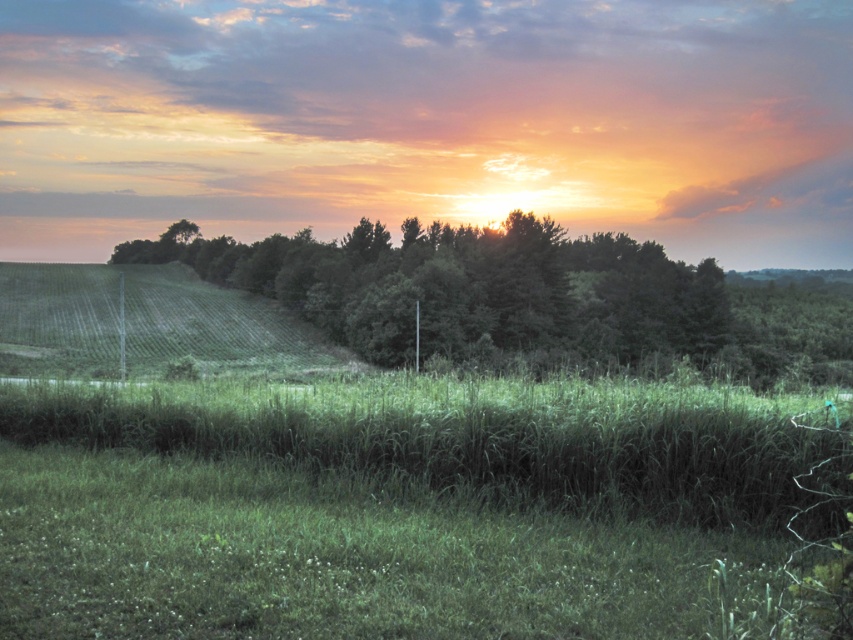
Question: Considering the real-world distances, which object is closest to the green grassy at center?

Choices:
 (A) green leafy trees at center
 (B) green grassy hillside at left

Answer: (B)

Question: Is green grassy at center below green leafy trees at center?

Choices:
 (A) yes
 (B) no

Answer: (A)

Question: Which object appears farthest from the camera in this image?

Choices:
 (A) green grassy hillside at left
 (B) green grassy at center

Answer: (A)

Question: Can you confirm if green leafy trees at center is smaller than green grassy hillside at left?

Choices:
 (A) yes
 (B) no

Answer: (B)

Question: Which point is closer to the camera?

Choices:
 (A) green grassy hillside at left
 (B) green grassy at center

Answer: (B)

Question: Can you confirm if green grassy at center is wider than green grassy hillside at left?

Choices:
 (A) no
 (B) yes

Answer: (A)